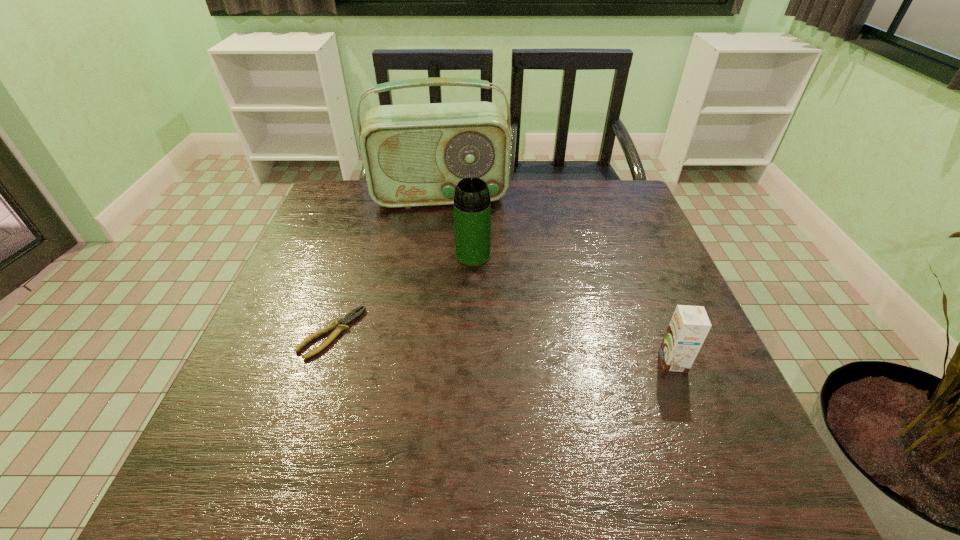
The width and height of the screenshot is (960, 540). Find the location of `free spot between the third shortest object and the chocolate milk`. free spot between the third shortest object and the chocolate milk is located at coordinates (573, 309).

You are a GUI agent. You are given a task and a screenshot of the screen. Output one action in this format:
    pyautogui.click(x=<x>, y=<y>)
    Task: Click on the vacant point located between the pliers and the third tallest object
    
    Given the screenshot: What is the action you would take?
    pyautogui.click(x=502, y=348)

This screenshot has width=960, height=540. I want to click on free point between the third tallest object and the thermos bottle, so click(573, 309).

Identify the location of blank region between the pliers and the farthest object. (386, 264).

This screenshot has width=960, height=540. I want to click on vacant space that's between the rightmost object and the third nearest object, so click(573, 309).

Where is `empty space between the rightmost object and the farthest object`? The width and height of the screenshot is (960, 540). empty space between the rightmost object and the farthest object is located at coordinates (557, 279).

Identify which object is the second nearest to the thermos bottle. Please provide its 2D coordinates. Your answer should be formatted as a tuple, i.e. [(x, y)], where the tuple contains the x and y coordinates of a point satisfying the conditions above.

[(339, 326)]

The image size is (960, 540). Find the location of `object that is the closest one to the pliers`. object that is the closest one to the pliers is located at coordinates (472, 205).

Where is `vacant space that satisfies the following two spatial constraints: 1. on the front side of the third shortest object; 2. on the right side of the second shortest object`? The width and height of the screenshot is (960, 540). vacant space that satisfies the following two spatial constraints: 1. on the front side of the third shortest object; 2. on the right side of the second shortest object is located at coordinates (470, 362).